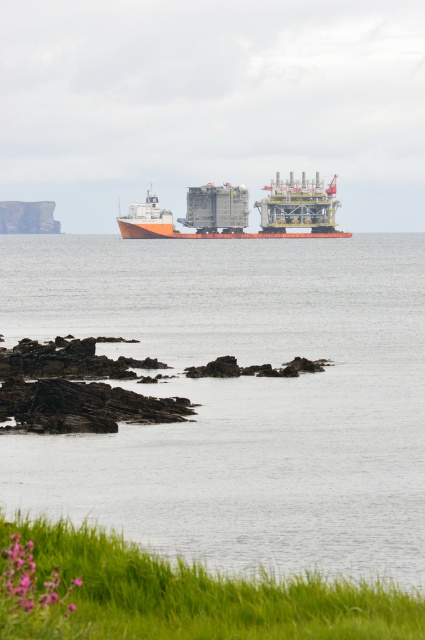
Question: Does clear water at center come behind orange matte cargo ship at center?

Choices:
 (A) yes
 (B) no

Answer: (B)

Question: Which of the following is the farthest from the observer?

Choices:
 (A) (331, 180)
 (B) (382, 340)

Answer: (A)

Question: Is clear water at center positioned at the back of orange matte cargo ship at center?

Choices:
 (A) no
 (B) yes

Answer: (A)

Question: In this image, where is clear water at center located relative to orange matte cargo ship at center?

Choices:
 (A) right
 (B) left

Answer: (A)

Question: Which point is farther to the camera?

Choices:
 (A) click(x=159, y=468)
 (B) click(x=130, y=220)

Answer: (B)

Question: Which object is farther from the camera taking this photo?

Choices:
 (A) clear water at center
 (B) orange matte cargo ship at center

Answer: (B)